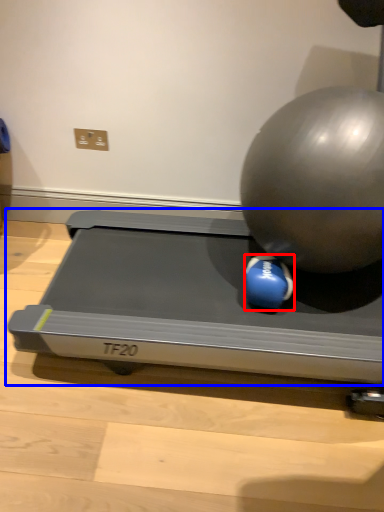
Question: Which point is further to the camera, ball (highlighted by a red box) or treadmill (highlighted by a blue box)?

Choices:
 (A) ball
 (B) treadmill

Answer: (A)